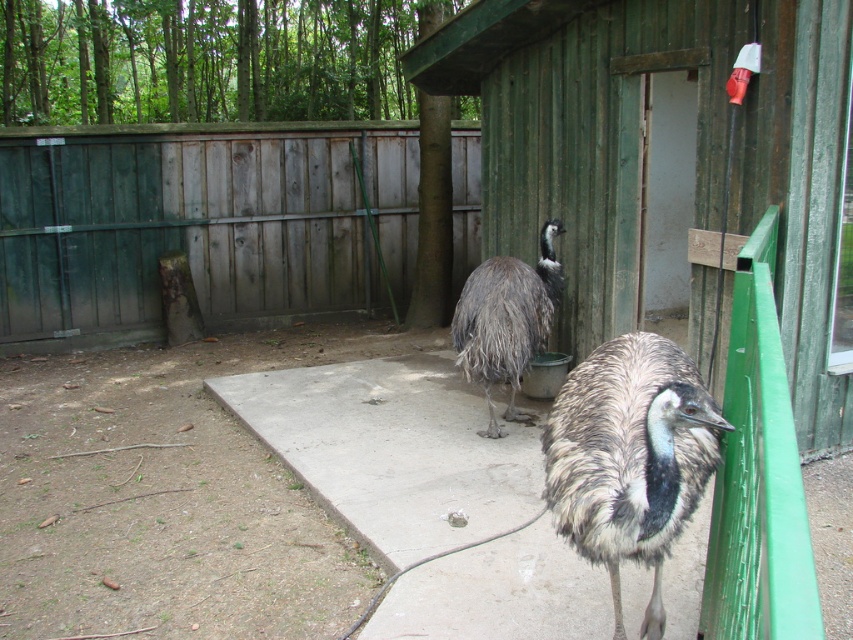
You are standing at the point marked by coordinates (199, 224) in the enclosure. Which fence type is directly behind you?

The weathered wood fence at left is directly behind you at the point marked by coordinates (199, 224).